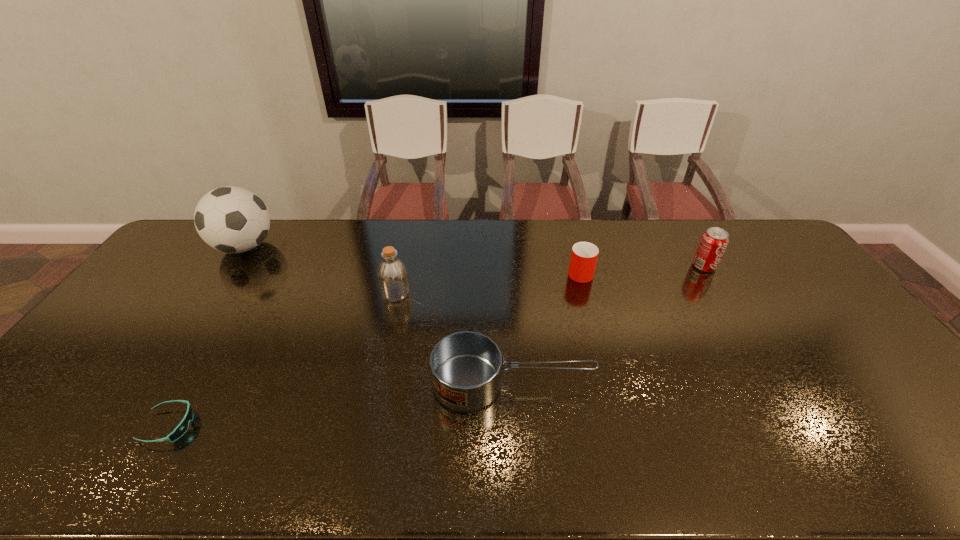
In order to click on free spot between the cup and the third tallest object in this screenshot , I will do `click(642, 269)`.

Locate an element on the screen. The image size is (960, 540). free spot between the fifth object from left to right and the fourth object from right to left is located at coordinates (488, 282).

The width and height of the screenshot is (960, 540). I want to click on empty space between the sunglasses and the fifth shortest object, so click(x=282, y=360).

Where is `free point between the bottle and the tallest object`? The width and height of the screenshot is (960, 540). free point between the bottle and the tallest object is located at coordinates (321, 270).

The image size is (960, 540). Identify the location of object that ranks as the fourth closest to the rightmost object. (231, 219).

Select which object appears as the second closest to the soda. Please provide its 2D coordinates. Your answer should be formatted as a tuple, i.e. [(x, y)], where the tuple contains the x and y coordinates of a point satisfying the conditions above.

[(465, 366)]

The height and width of the screenshot is (540, 960). In order to click on free space that satisfies the following two spatial constraints: 1. on the front side of the soccer ball; 2. on the left side of the fourth object from right to left in this screenshot , I will do `click(214, 293)`.